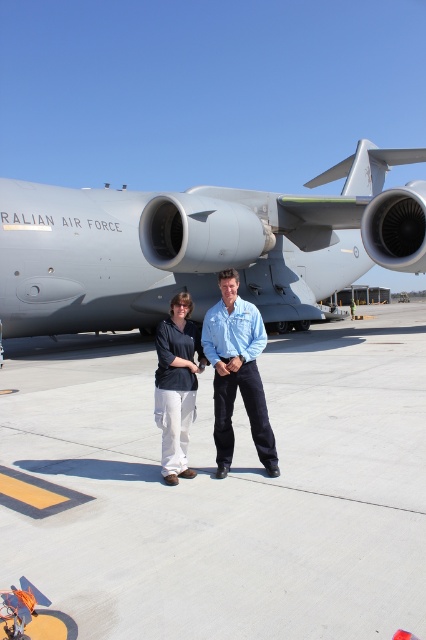
Describe the element at coordinates (198, 244) in the screenshot. I see `gray matte airplane at center` at that location.

Between gray matte airplane at center and matte black shirt at center, which one has less height?

matte black shirt at center is shorter.

Is point (221, 221) positioned before point (186, 324)?

No, (221, 221) is further to viewer.

Where is `gray matte airplane at center`? This screenshot has height=640, width=426. gray matte airplane at center is located at coordinates (198, 244).

Who is taller, gray matte airplane at center or light blue shirt at center?

With more height is gray matte airplane at center.

Can you confirm if gray matte airplane at center is positioned to the left of light blue shirt at center?

No, gray matte airplane at center is not to the left of light blue shirt at center.

Locate an element on the screen. gray matte airplane at center is located at coordinates 198,244.

Who is positioned more to the right, light blue shirt at center or matte black shirt at center?

light blue shirt at center

Between light blue shirt at center and matte black shirt at center, which one is positioned lower?

matte black shirt at center is below.

Which is behind, point (230, 417) or point (183, 426)?

Positioned behind is point (183, 426).

Locate an element on the screen. The image size is (426, 640). light blue shirt at center is located at coordinates (236, 372).